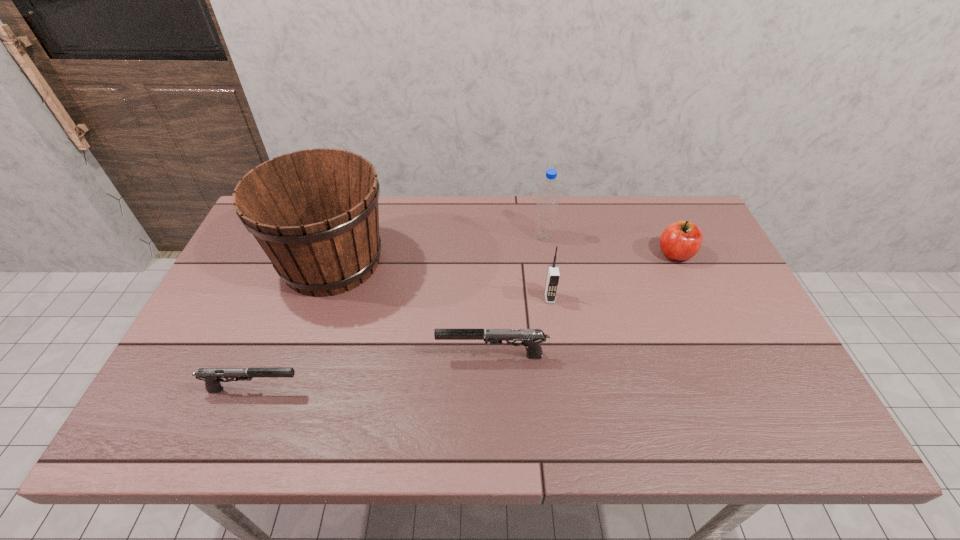
Where is `the nearest object`? This screenshot has height=540, width=960. the nearest object is located at coordinates (212, 376).

What are the coordinates of `the left gun` in the screenshot? It's located at (212, 376).

Where is `the fourth object from right to left`? This screenshot has height=540, width=960. the fourth object from right to left is located at coordinates (530, 338).

Find the location of a particular element. the farther gun is located at coordinates (530, 338).

Image resolution: width=960 pixels, height=540 pixels. I want to click on apple, so click(x=680, y=241).

The image size is (960, 540). I want to click on water bottle, so click(x=547, y=203).

Image resolution: width=960 pixels, height=540 pixels. Find the location of `wine bucket`. wine bucket is located at coordinates (315, 214).

The height and width of the screenshot is (540, 960). What are the coordinates of `cellular telephone` in the screenshot? It's located at (553, 275).

This screenshot has width=960, height=540. What are the coordinates of `free space located at the muzzle end of the nearer gun` in the screenshot? It's located at (380, 389).

Locate an element on the screen. The height and width of the screenshot is (540, 960). free space located at the muzzle end of the taller gun is located at coordinates (348, 356).